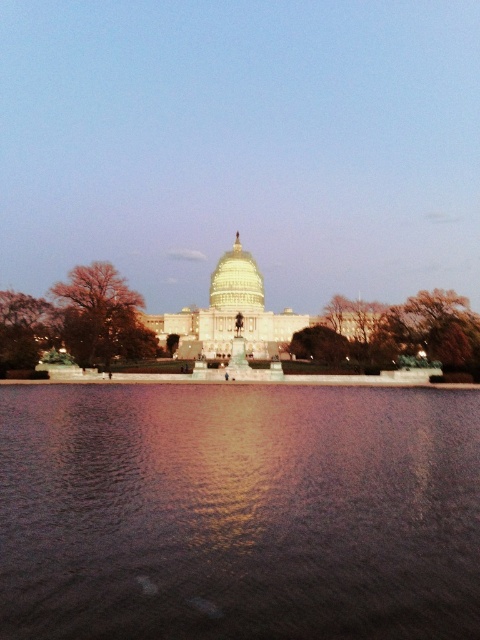
Which is more to the left, green leafy tree at left or gold reflective dome at center?

green leafy tree at left is more to the left.

This screenshot has height=640, width=480. In order to click on green leafy tree at left in this screenshot , I will do `click(24, 330)`.

Is point (4, 339) less distant than point (211, 298)?

Yes, point (4, 339) is closer to viewer.

Where is `green leafy tree at left`? The width and height of the screenshot is (480, 640). green leafy tree at left is located at coordinates (24, 330).

Can you confirm if glistening reflective water at center is smaller than brown textured tree at left?

Incorrect, glistening reflective water at center is not smaller in size than brown textured tree at left.

Who is shorter, glistening reflective water at center or brown textured tree at left?

Standing shorter between the two is glistening reflective water at center.

Which is behind, point (8, 506) or point (93, 298)?

Positioned behind is point (93, 298).

In order to click on glistening reflective water at center in this screenshot , I will do `click(239, 512)`.

Can you confirm if glistening reflective water at center is positioned to the left of gold reflective dome at center?

No, glistening reflective water at center is not to the left of gold reflective dome at center.

Can you confirm if glistening reflective water at center is positioned below gold reflective dome at center?

Yes, glistening reflective water at center is below gold reflective dome at center.

Is point (325, 531) more distant than point (247, 252)?

No, it is in front of (247, 252).

I want to click on glistening reflective water at center, so click(239, 512).